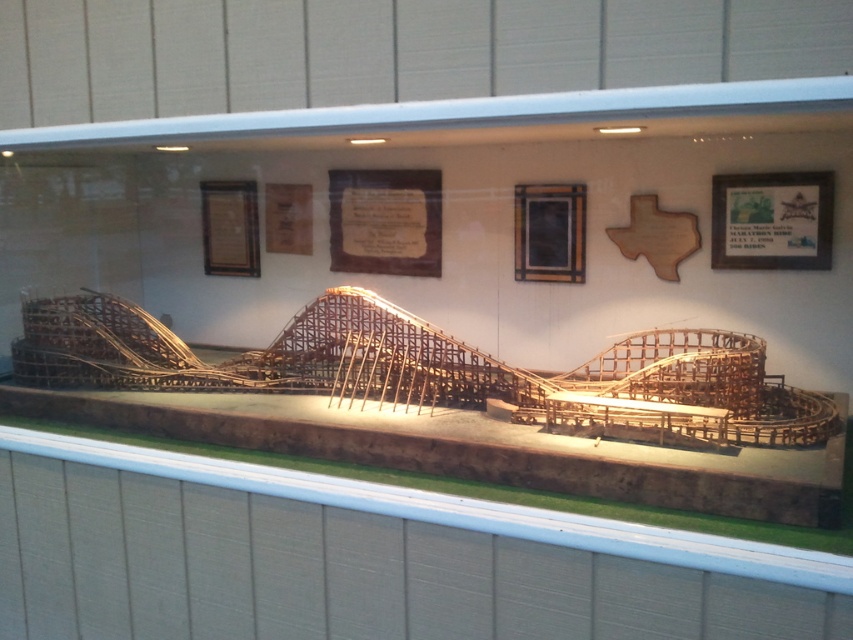
You are an appraiser assessing the display case. You need to determine which object is shorter between the wooden plaque at upper right and the wooden frame at center. Which one is shorter?

The wooden plaque at upper right is shorter than the wooden frame at center.

You are an appraiser assessing the display case. You need to determine if the wooden plaque at upper right is visible from the front of the case. Based on their positions, can you see it behind the matte wood plaque at center?

The wooden plaque at upper right is behind the matte wood plaque at center, so it is partially or fully obscured and may not be visible from the front of the case.

You are a security guard in the museum and want to inspect the matte wood plaque at center. The security system shows the plaque is at coordinates 0.347, 0.453. If you are standing at the origin point, which direction should you move to reach the plaque?

The matte wood plaque at center is located at coordinates (386, 221). Since the x and y values are both positive, you should move northeast to reach it.